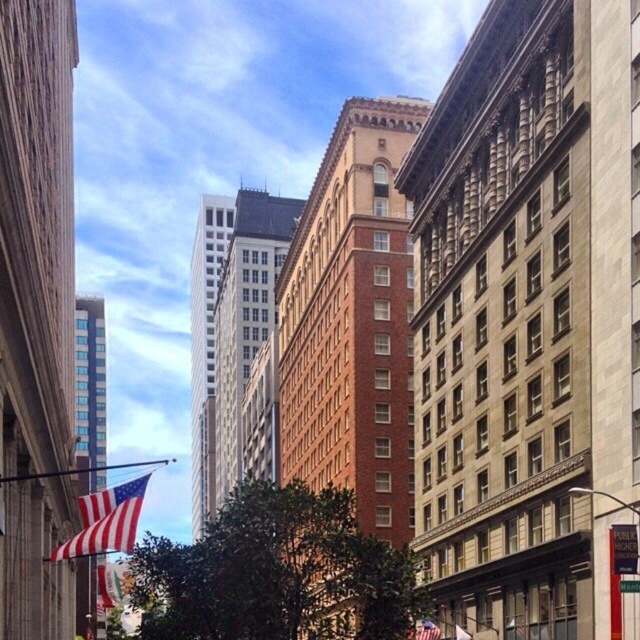
Who is positioned more to the right, red-white striped fabric flag at lower left or red fabric flag at left?

From the viewer's perspective, red fabric flag at left appears more on the right side.

Does red-white striped fabric flag at lower left have a smaller size compared to red fabric flag at left?

A: No, red-white striped fabric flag at lower left is not smaller than red fabric flag at left.

This screenshot has height=640, width=640. I want to click on red-white striped fabric flag at lower left, so click(x=106, y=520).

The height and width of the screenshot is (640, 640). In order to click on red-white striped fabric flag at lower left in this screenshot , I will do `click(106, 520)`.